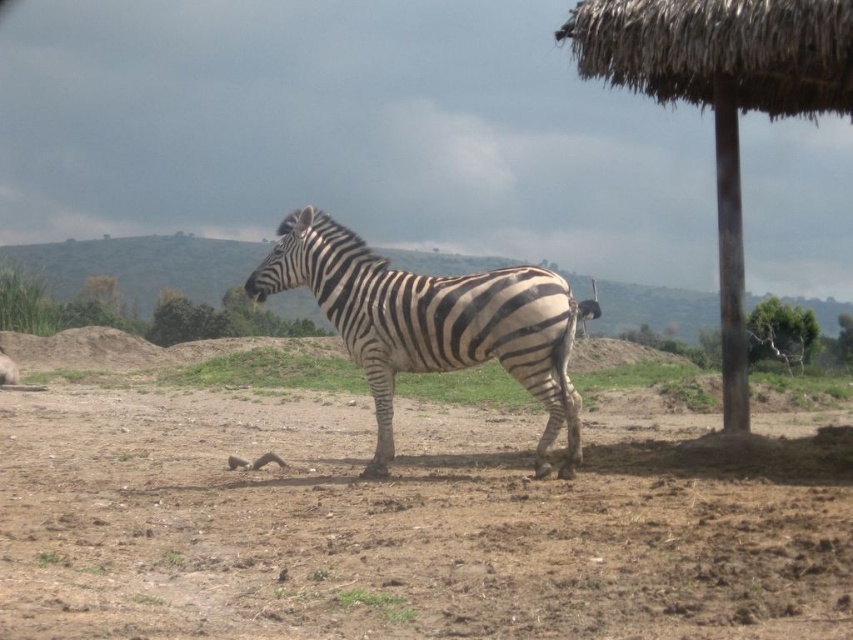
You are a wildlife photographer aiming to capture the zebra in the center. Given that your camera is focused at coordinates 0.5, 0.5, will the black and white striped zebra at center be in focus?

The black and white striped zebra at center is located at point (430, 323), which is very close to the camera focus coordinates (426, 320). Therefore, the zebra will be in focus.

You are a visitor at the zoo and want to take a photo of the zebra with both the brown wooden pole at right and the green leafy tree at upper right in the background. Which object should you position closer to the edge of the frame to include both in the shot?

To include both the brown wooden pole at right and the green leafy tree at upper right in the background, you should position the green leafy tree at upper right closer to the edge of the frame since the brown wooden pole at right is already to the right of it, making it farther away from the left edge.

You are a visitor at the zoo and want to take a photo of the black and white striped zebra at center. However, you notice a brown wooden pole at right in the background. Based on the scene, will the pole appear in your photo if you frame the zebra in the center?

Yes, the pole will appear in your photo because the black and white striped zebra at center is positioned under the brown wooden pole at right, meaning the pole is directly behind the zebra and would be in the frame when centered.